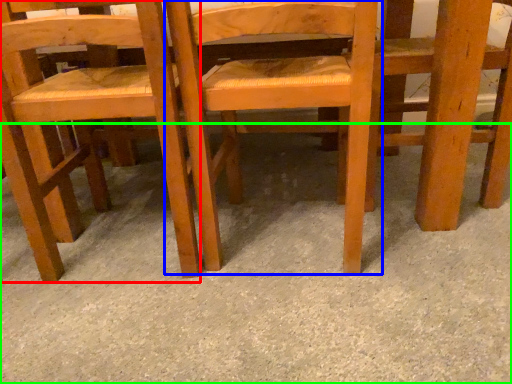
Question: Which is nearer to the chair (highlighted by a red box)? chair (highlighted by a blue box) or concrete (highlighted by a green box).

Choices:
 (A) chair
 (B) concrete

Answer: (A)